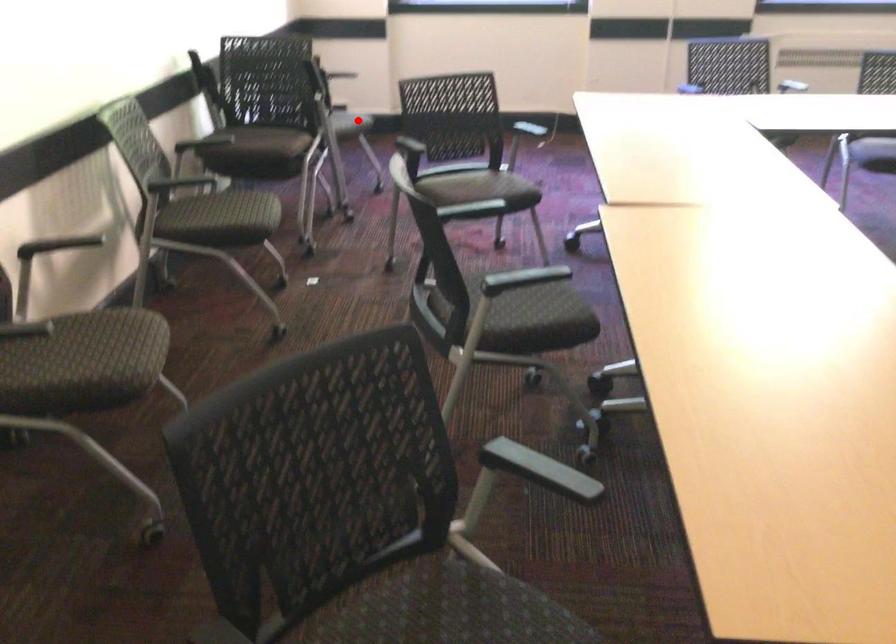
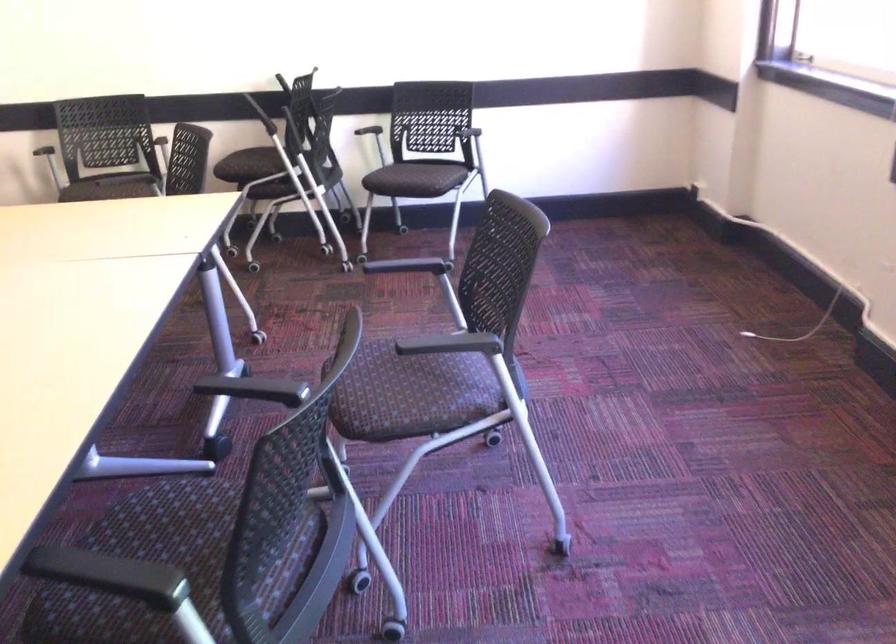
Question: I am providing you with two images of the same scene from different viewpoints. A red point is marked on the first image. Can you still see the location of the red point in image 2?

Choices:
 (A) Yes
 (B) No

Answer: (A)